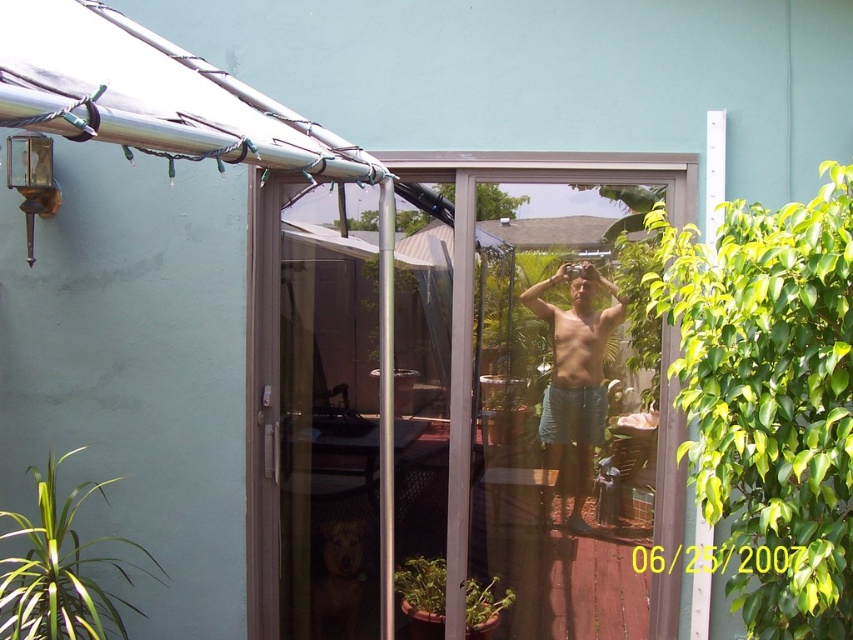
From the picture: Does clear glass door at center have a lesser width compared to transparent glass screen door at center?

No.

Is point (660, 476) more distant than point (463, 384)?

No, it is not.

Measure the distance between point (590,506) and camera.

A distance of 3.19 meters exists between point (590,506) and camera.

Locate an element on the screen. The image size is (853, 640). clear glass door at center is located at coordinates (450, 404).

Is point (585, 227) positioned in front of point (332, 545)?

Yes, it is.

Find the location of a particular element. This screenshot has height=640, width=853. clear glass door at center is located at coordinates (x=450, y=404).

Does point (537, 404) lie in front of point (590, 458)?

No, (537, 404) is further to viewer.

Is point (538, 289) farther from viewer compared to point (590, 308)?

Yes.

At what (x,y) coordinates should I click in order to perform the action: click on transparent glass screen door at center. Please return your answer as a coordinate pair (x, y). Looking at the image, I should click on (558, 406).

Where is `transparent glass screen door at center`? Image resolution: width=853 pixels, height=640 pixels. transparent glass screen door at center is located at coordinates (558, 406).